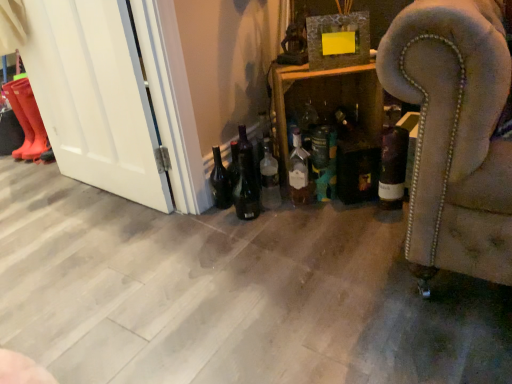
I want to click on vacant space in front of green matte bottle at center, the 3th bottle from the right, so click(x=335, y=217).